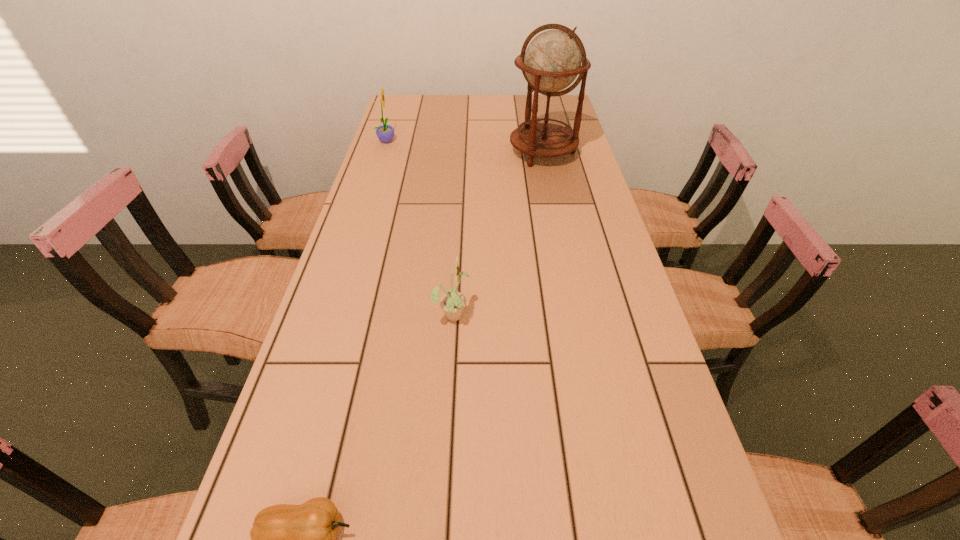
You are a GUI agent. You are given a task and a screenshot of the screen. Output one action in this format:
    pyautogui.click(x=<x>, y=<y>)
    Task: Click on the blank region between the second object from right to left and the left sunflower
    The height and width of the screenshot is (540, 960).
    Given the screenshot: What is the action you would take?
    pyautogui.click(x=420, y=227)

Identify which object is the nearest to the shortest object. Please provide its 2D coordinates. Your answer should be formatted as a tuple, i.e. [(x, y)], where the tuple contains the x and y coordinates of a point satisfying the conditions above.

[(452, 302)]

Image resolution: width=960 pixels, height=540 pixels. I want to click on object that stands as the closest to the tallest object, so (x=385, y=133).

In order to click on vacant space that satisfies the following two spatial constraints: 1. on the surface of the globe; 2. on the front-facing side of the nearer sunflower in this screenshot , I will do `click(576, 314)`.

Identify the location of free space that satisfies the following two spatial constraints: 1. on the surface of the rightmost object; 2. on the front-facing side of the nearer sunflower. This screenshot has height=540, width=960. (576, 314).

Image resolution: width=960 pixels, height=540 pixels. Find the location of `free spot that satisfies the following two spatial constraints: 1. on the surface of the rightmost object; 2. on the front-facing side of the second nearest object`. free spot that satisfies the following two spatial constraints: 1. on the surface of the rightmost object; 2. on the front-facing side of the second nearest object is located at coordinates (576, 314).